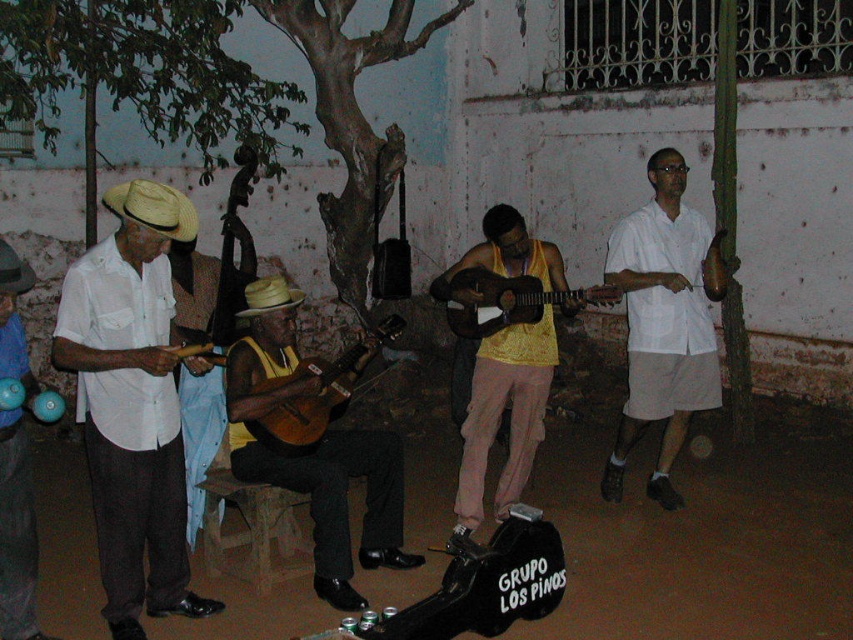
You are a photographer standing at the center of the scene. You want to take a photo of the matte yellow tank top at center. Based on its 2D coordinates, where should you aim your camera?

The matte yellow tank top at center is located at the 2D coordinates point (312, 451), so you should aim your camera towards that point to capture it.